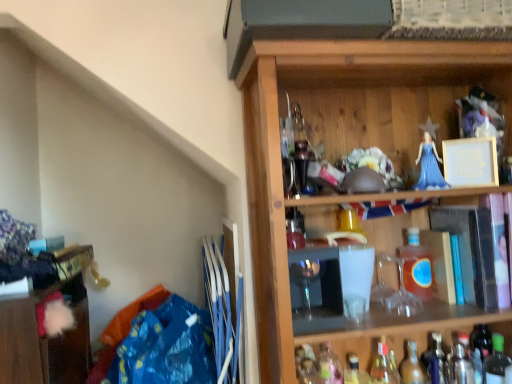
Question: Can you confirm if translucent glass bottle at lower right, which is the third bottle from left to right, is positioned to the left of translucent amber glass bottle at center-right, arranged as the 4th bottle when viewed from the left?

Choices:
 (A) yes
 (B) no

Answer: (A)

Question: Is translucent glass bottle at lower right, marked as the sixth bottle in a right-to-left arrangement, further to the viewer compared to translucent amber glass bottle at center-right, which is counted as the fifth bottle, starting from the right?

Choices:
 (A) no
 (B) yes

Answer: (B)

Question: Can you confirm if translucent glass bottle at lower right, marked as the sixth bottle in a right-to-left arrangement, is shorter than translucent amber glass bottle at center-right, which is counted as the fifth bottle, starting from the right?

Choices:
 (A) yes
 (B) no

Answer: (A)

Question: Is translucent amber glass bottle at center-right, which is counted as the fifth bottle, starting from the right, completely or partially inside translucent glass bottle at lower right, marked as the sixth bottle in a right-to-left arrangement?

Choices:
 (A) yes
 (B) no

Answer: (B)

Question: Are translucent glass bottle at lower right, marked as the sixth bottle in a right-to-left arrangement, and translucent amber glass bottle at center-right, arranged as the 4th bottle when viewed from the left, beside each other?

Choices:
 (A) yes
 (B) no

Answer: (B)

Question: From a real-world perspective, is translucent glass bottle at lower right, the fourth bottle in the right-to-left sequence, above or below metallic silver shaker at lower right, the 7th bottle from the left?

Choices:
 (A) above
 (B) below

Answer: (B)

Question: Is translucent glass bottle at lower right, the fourth bottle in the right-to-left sequence, wider or thinner than metallic silver shaker at lower right, the 7th bottle from the left?

Choices:
 (A) wide
 (B) thin

Answer: (B)

Question: In terms of size, does translucent glass bottle at lower right, which ranks as the fifth bottle in left-to-right order, appear bigger or smaller than metallic silver shaker at lower right, the 7th bottle from the left?

Choices:
 (A) small
 (B) big

Answer: (B)

Question: Considering the positions of point [423, 369] and point [465, 336], is point [423, 369] closer or farther from the camera than point [465, 336]?

Choices:
 (A) farther
 (B) closer

Answer: (B)

Question: In terms of width, does metallic silver shaker at lower right, the 7th bottle from the left, look wider or thinner when compared to wooden cabinet at lower left?

Choices:
 (A) wide
 (B) thin

Answer: (B)

Question: From the image's perspective, relative to wooden cabinet at lower left, is metallic silver shaker at lower right, the 7th bottle from the left, above or below?

Choices:
 (A) above
 (B) below

Answer: (B)

Question: Based on their sizes in the image, would you say metallic silver shaker at lower right, which appears as the second bottle when viewed from the right, is bigger or smaller than wooden cabinet at lower left?

Choices:
 (A) big
 (B) small

Answer: (B)

Question: Considering the positions of point (450, 382) and point (47, 362), is point (450, 382) closer or farther from the camera than point (47, 362)?

Choices:
 (A) farther
 (B) closer

Answer: (A)

Question: In the image, is wooden cabinet at lower left positioned in front of or behind translucent glass bottle at lower right, marked as the 3th bottle in a right-to-left arrangement?

Choices:
 (A) behind
 (B) front

Answer: (B)

Question: Which is correct: wooden cabinet at lower left is inside translucent glass bottle at lower right, positioned as the sixth bottle in left-to-right order, or outside of it?

Choices:
 (A) inside
 (B) outside

Answer: (B)